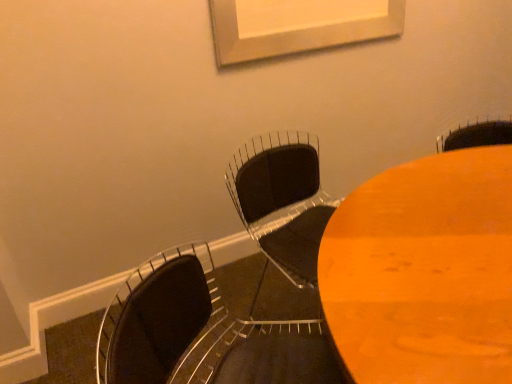
Question: Considering the relative positions of wooden table at center and matte black chair at lower left, the 2th chair viewed from the back, in the image provided, is wooden table at center behind matte black chair at lower left, the 2th chair viewed from the back,?

Choices:
 (A) no
 (B) yes

Answer: (B)

Question: Does wooden table at center appear on the right side of matte black chair at lower left, the 2th chair viewed from the back?

Choices:
 (A) yes
 (B) no

Answer: (A)

Question: Is wooden table at center facing towards matte black chair at lower left, the 1th chair in the front-to-back sequence?

Choices:
 (A) no
 (B) yes

Answer: (A)

Question: Could matte black chair at lower left, the 1th chair in the front-to-back sequence, be considered to be inside wooden table at center?

Choices:
 (A) yes
 (B) no

Answer: (B)

Question: Does wooden table at center have a greater width compared to matte black chair at lower left, the 1th chair in the front-to-back sequence?

Choices:
 (A) yes
 (B) no

Answer: (A)

Question: Is matte black chair at lower left, the 2th chair viewed from the back, to the left or to the right of black matte chair at center, positioned as the first chair in back-to-front order, in the image?

Choices:
 (A) left
 (B) right

Answer: (A)

Question: Relative to black matte chair at center, positioned as the first chair in back-to-front order, is matte black chair at lower left, the 2th chair viewed from the back, in front or behind?

Choices:
 (A) front
 (B) behind

Answer: (A)

Question: In terms of height, does matte black chair at lower left, the 1th chair in the front-to-back sequence, look taller or shorter compared to black matte chair at center, positioned as the first chair in back-to-front order?

Choices:
 (A) short
 (B) tall

Answer: (B)

Question: Looking at the image, does matte black chair at lower left, the 1th chair in the front-to-back sequence, seem bigger or smaller compared to black matte chair at center, positioned as the 2th chair in front-to-back order?

Choices:
 (A) big
 (B) small

Answer: (A)

Question: Is black matte chair at center, positioned as the first chair in back-to-front order, inside or outside of matte black chair at lower left, the 1th chair in the front-to-back sequence?

Choices:
 (A) outside
 (B) inside

Answer: (A)

Question: From a real-world perspective, is black matte chair at center, positioned as the first chair in back-to-front order, physically located above or below matte black chair at lower left, the 1th chair in the front-to-back sequence?

Choices:
 (A) above
 (B) below

Answer: (B)

Question: Considering the positions of point (288, 278) and point (142, 329), is point (288, 278) closer or farther from the camera than point (142, 329)?

Choices:
 (A) farther
 (B) closer

Answer: (A)

Question: Is black matte chair at center, positioned as the 2th chair in front-to-back order, taller or shorter than matte black chair at lower left, the 2th chair viewed from the back?

Choices:
 (A) short
 (B) tall

Answer: (A)

Question: Is wooden table at center taller or shorter than black matte chair at center, positioned as the 2th chair in front-to-back order?

Choices:
 (A) short
 (B) tall

Answer: (B)

Question: From a real-world perspective, is wooden table at center above or below black matte chair at center, positioned as the first chair in back-to-front order?

Choices:
 (A) below
 (B) above

Answer: (A)